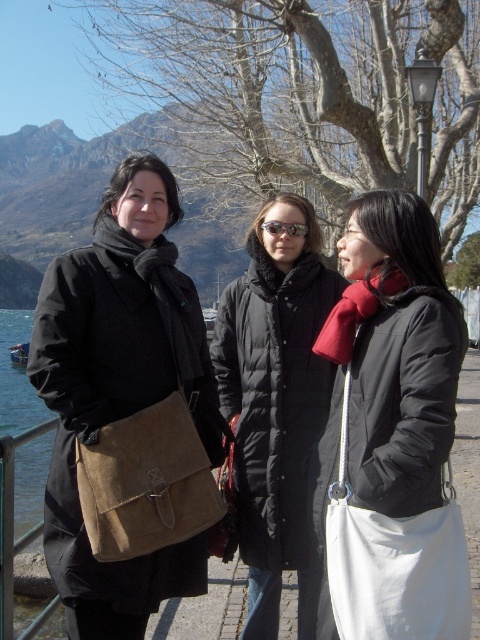
You are a photographer trying to capture a clear shot of the reflective plastic goggles at center. However, the matte black coat at left is blocking your view. Can you move to the right or left to avoid the obstruction?

The matte black coat at left is located below the reflective plastic goggles at center, so moving to the right might allow you to avoid the obstruction caused by the matte black coat at left.

You are standing in the scenic area near the lake and want to take a photo of the black puffy coat at center. Where should you position yourself to capture it in the frame?

To capture the black puffy coat at center in the frame, position yourself so that the coat is centered at the coordinates approximately 0.622 on the x axis and 0.571 on the y axis of the image plane.